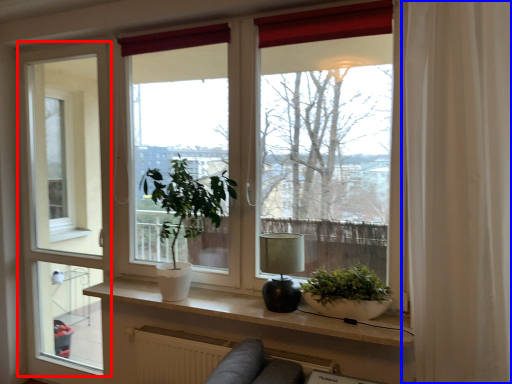
Question: Among these objects, which one is nearest to the camera, screen door (highlighted by a red box) or curtain (highlighted by a blue box)?

Choices:
 (A) screen door
 (B) curtain

Answer: (B)